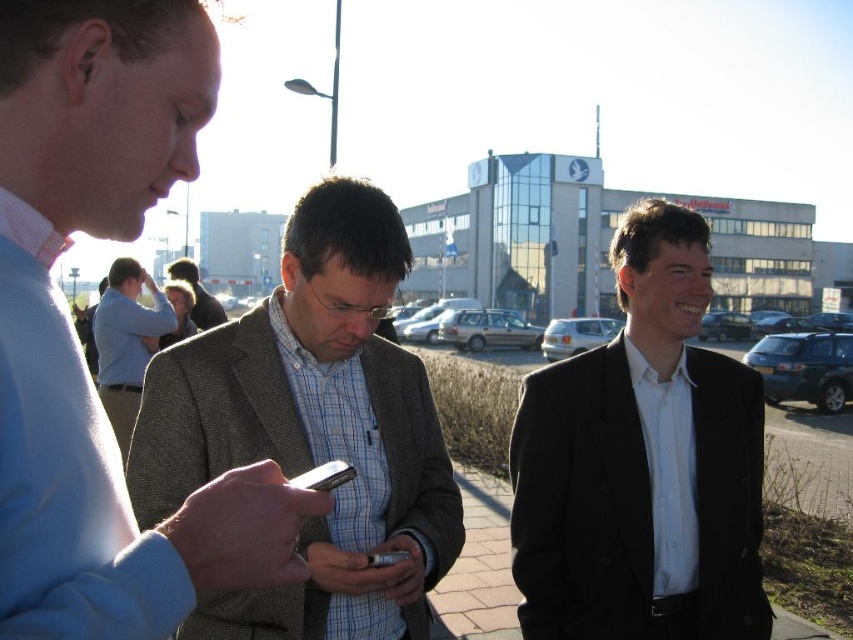
Question: Which point is farther to the camera?

Choices:
 (A) (210, 305)
 (B) (706, 500)

Answer: (A)

Question: Is light brown textured blazer at center further to camera compared to metallic silver smartphone at center?

Choices:
 (A) no
 (B) yes

Answer: (B)

Question: Which object appears farthest from the camera in this image?

Choices:
 (A) light blue shirt at center
 (B) light brown textured blazer at center

Answer: (B)

Question: Which is nearer to the light blue shirt at center?

Choices:
 (A) plaid fabric shirt at center
 (B) black matte suit at right
 (C) light brown textured blazer at center

Answer: (C)

Question: Is plaid fabric shirt at center above black matte suit at right?

Choices:
 (A) no
 (B) yes

Answer: (B)

Question: From the image, what is the correct spatial relationship of light blue shirt at left in relation to light brown textured blazer at center?

Choices:
 (A) below
 (B) above

Answer: (A)